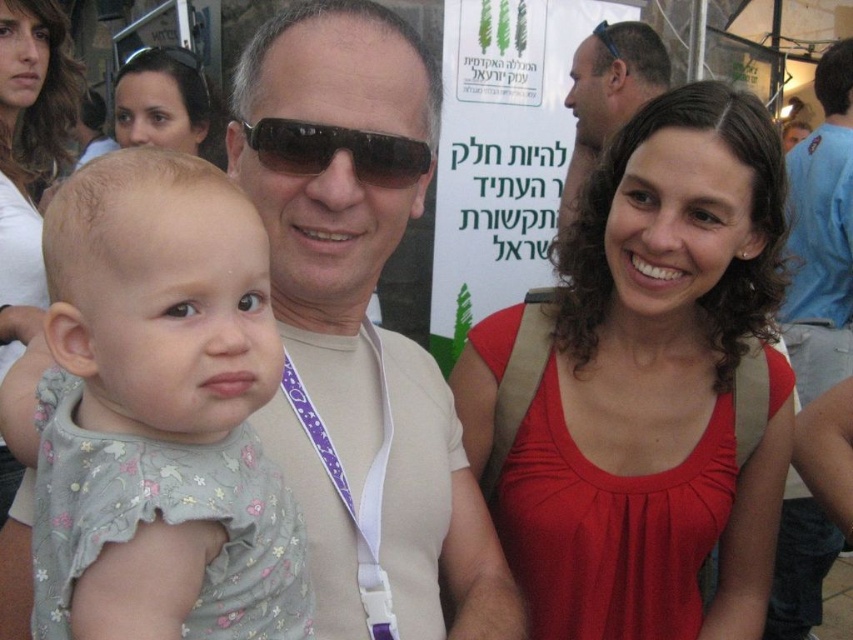
Question: Is the position of matte beige shirt at center more distant than that of black plastic goggles at upper left?

Choices:
 (A) yes
 (B) no

Answer: (B)

Question: Which object is the farthest from the matte black sunglasses at upper left?

Choices:
 (A) blue cotton shirt at upper right
 (B) matte beige shirt at upper center
 (C) red matte tank top at center

Answer: (A)

Question: Which object appears farthest from the camera in this image?

Choices:
 (A) matte beige shirt at upper center
 (B) matte black sunglasses at upper left

Answer: (A)

Question: Does red matte tank top at center appear over sunglasses at center?

Choices:
 (A) no
 (B) yes

Answer: (A)

Question: Considering the relative positions of red matte tank top at center and sunglasses at center in the image provided, where is red matte tank top at center located with respect to sunglasses at center?

Choices:
 (A) below
 (B) above

Answer: (A)

Question: Which is farther from the red matte tank top at center?

Choices:
 (A) matte beige shirt at center
 (B) matte black sunglasses at upper left

Answer: (B)